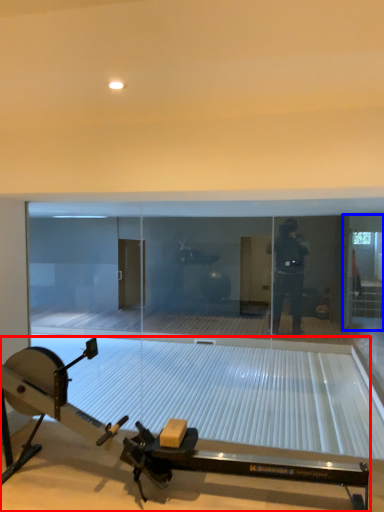
Question: Among these objects, which one is nearest to the camera, sport equipment (highlighted by a red box) or glass door (highlighted by a blue box)?

Choices:
 (A) sport equipment
 (B) glass door

Answer: (A)